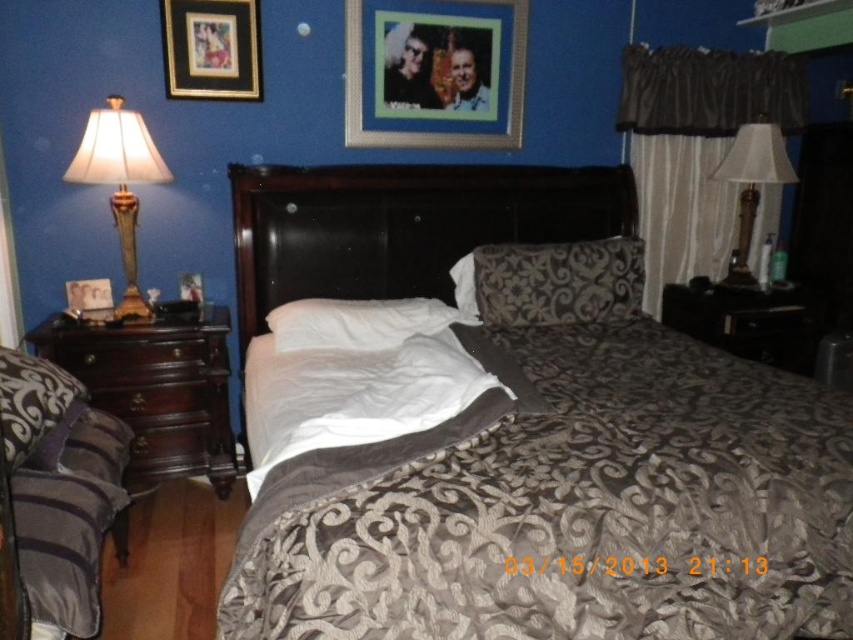
You are standing in the bedroom and want to reach both the point at coordinates point (486, 88) and the point at coordinates point (439, 321). Which point will you reach first as you move towards them?

You will reach point (486, 88) first because it is closer to you than point (439, 321), which is further away.

You are trying to decide whether to place a new large painting on the wall. The painting is the same size as the brown fabric curtain at right. Would the dark gray textured pillow at lower left fit in the space currently occupied by the curtain?

The brown fabric curtain at right is larger in size than the dark gray textured pillow at lower left. Since the painting is the same size as the curtain, the space it occupies would be larger than the pillow. Therefore, the dark gray textured pillow at lower left would fit in that space.

You are standing in the bedroom and want to take a photo of the metallic silver picture frame at upper center using your camera. The camera requires a minimum distance of 3 meters to focus properly. Can you take a clear photo from where you are holding the camera?

The metallic silver picture frame at upper center and camera are 2.97 meters apart from each other. Since the camera requires a minimum distance of 3 meters to focus properly, you are 0.03 meters too close to take a clear photo.